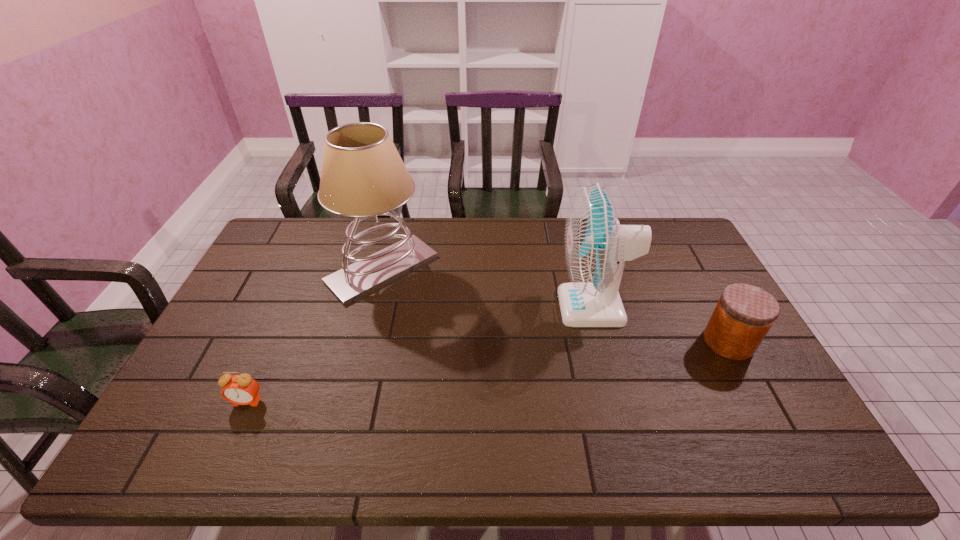
Identify which object is the second closest to the second shortest object. Please provide its 2D coordinates. Your answer should be formatted as a tuple, i.e. [(x, y)], where the tuple contains the x and y coordinates of a point satisfying the conditions above.

[(363, 175)]

This screenshot has height=540, width=960. I want to click on object that is the closest to the second object from left to right, so click(239, 389).

Where is `free region that satisfies the following two spatial constraints: 1. in front of the third tallest object to face the airflow; 2. on the right side of the fan`? This screenshot has width=960, height=540. free region that satisfies the following two spatial constraints: 1. in front of the third tallest object to face the airflow; 2. on the right side of the fan is located at coordinates (602, 342).

Identify the location of free space that satisfies the following two spatial constraints: 1. on the front side of the second object from left to right; 2. on the left side of the jar. The height and width of the screenshot is (540, 960). (364, 342).